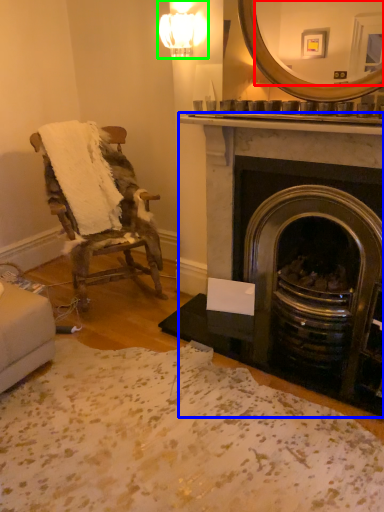
Question: Which object is the farthest from mirror (highlighted by a red box)? Choose among these: fireplace (highlighted by a blue box) or light fixture (highlighted by a green box).

Choices:
 (A) fireplace
 (B) light fixture

Answer: (B)